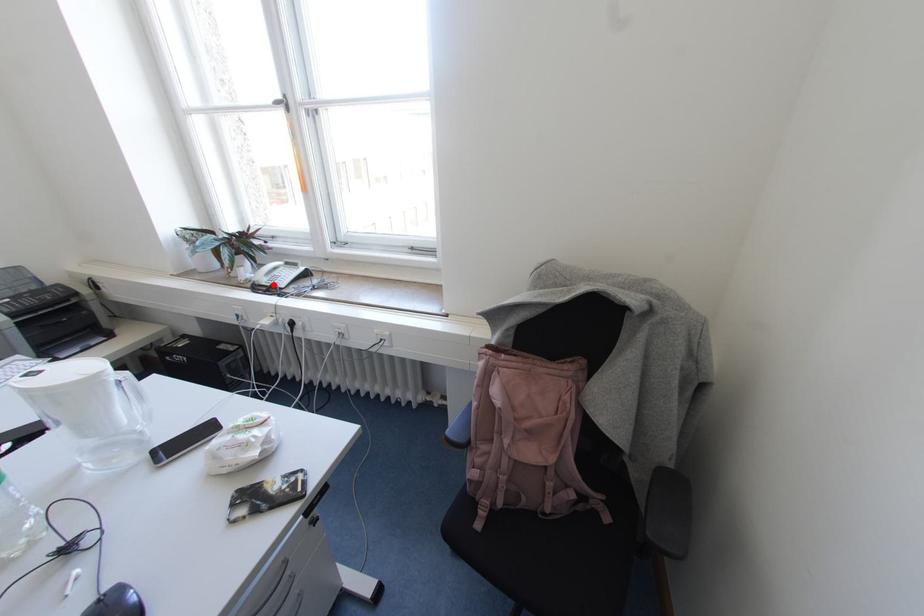
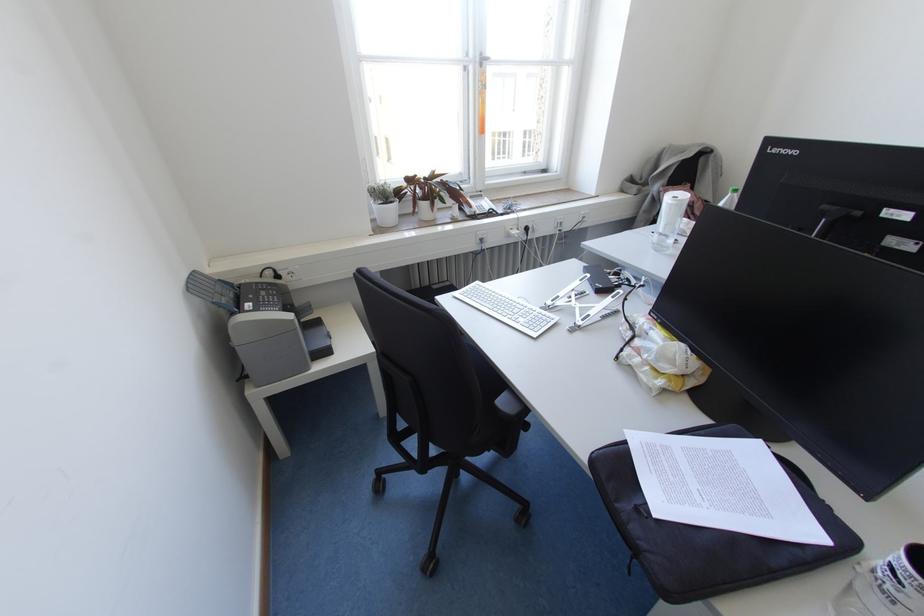
Where in the second image is the point corresponding to the highlighted location from the first image?

(490, 209)